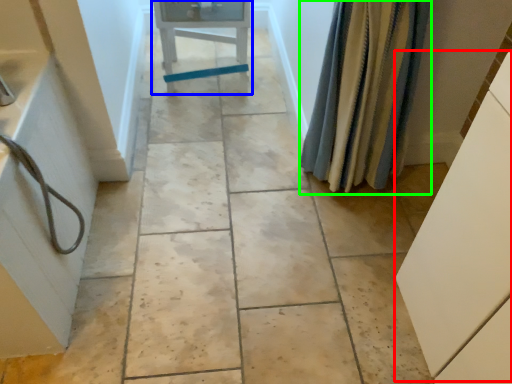
Question: Estimate the real-world distances between objects in this image. Which object is farther from cabinetry (highlighted by a red box), furniture (highlighted by a blue box) or shower curtain (highlighted by a green box)?

Choices:
 (A) furniture
 (B) shower curtain

Answer: (A)